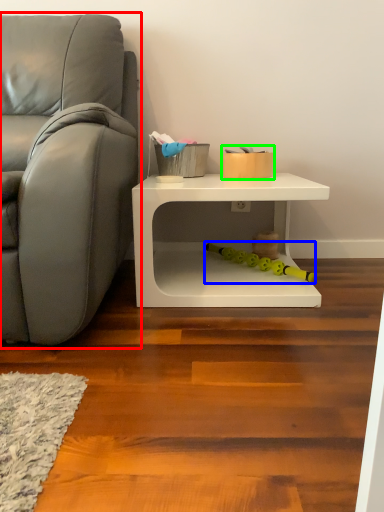
Question: Which is nearer to the studio couch (highlighted by a red box)? toy (highlighted by a blue box) or toy (highlighted by a green box).

Choices:
 (A) toy
 (B) toy

Answer: (B)